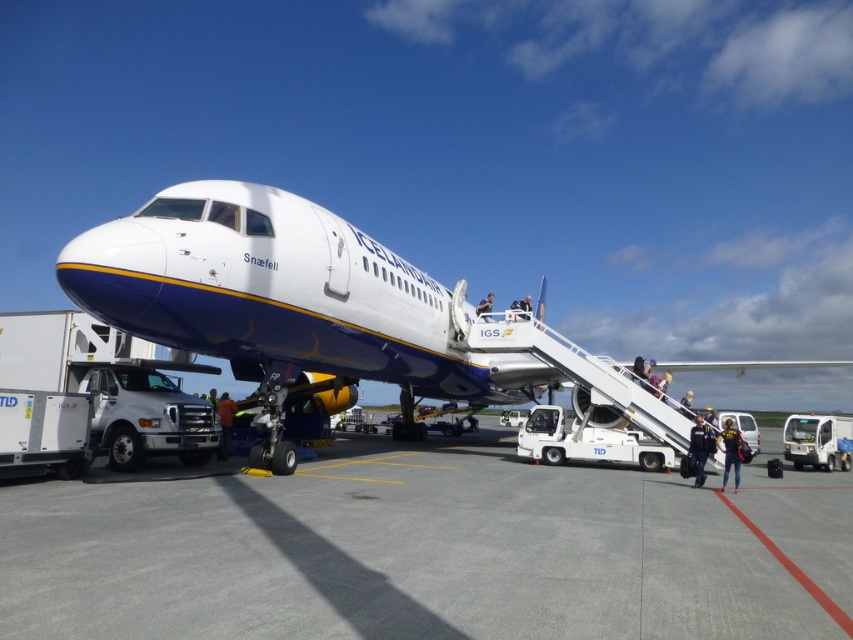
Question: Which point is closer to the camera taking this photo?

Choices:
 (A) (105, 248)
 (B) (344, 596)

Answer: (B)

Question: Is gray concrete tarmac at center wider than white matte airplane at center?

Choices:
 (A) no
 (B) yes

Answer: (A)

Question: Is dark blue uniform at center positioned behind yellow fabric jacket at center?

Choices:
 (A) yes
 (B) no

Answer: (A)

Question: Considering the real-world distances, which object is closest to the blue fabric jacket at upper center?

Choices:
 (A) orange reflective vest at lower center
 (B) white fabric shirt at upper center

Answer: (B)

Question: Is dark blue uniform at center to the right of white fabric shirt at upper center from the viewer's perspective?

Choices:
 (A) yes
 (B) no

Answer: (B)

Question: Which object is the farthest from the dark blue uniform at center?

Choices:
 (A) white matte airplane at center
 (B) gray concrete tarmac at center

Answer: (A)